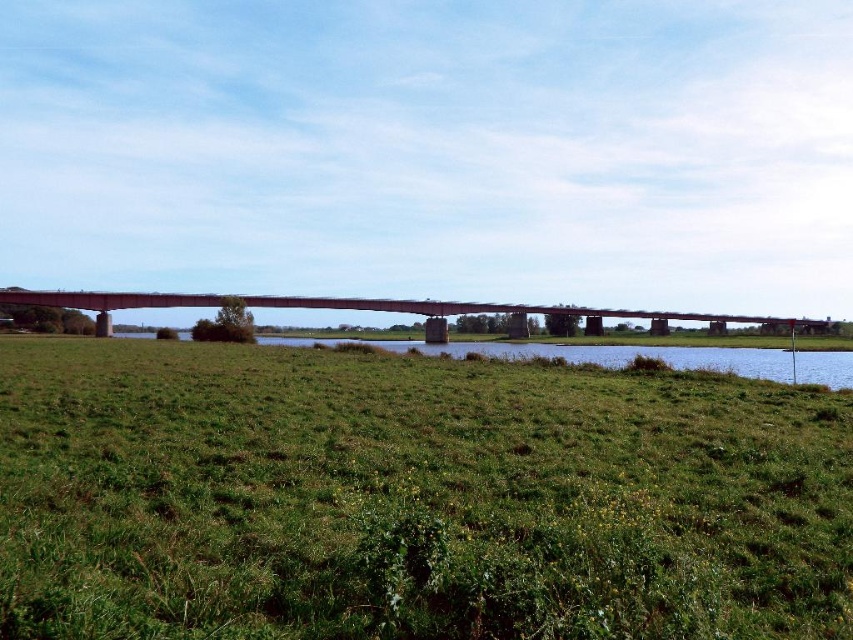
How much distance is there between green grassy field at center and concrete bridge at center?

The distance of green grassy field at center from concrete bridge at center is 95.30 meters.

Is green grassy field at center smaller than concrete bridge at center?

Yes.

Where is `green grassy field at center`? The image size is (853, 640). green grassy field at center is located at coordinates (412, 499).

Who is positioned more to the right, green grassy field at center or green grassy field at lower center?

green grassy field at center

Which of these two, green grassy field at center or green grassy field at lower center, stands taller?

green grassy field at lower center is taller.

Locate an element on the screen. The image size is (853, 640). green grassy field at center is located at coordinates (412, 499).

I want to click on green grassy field at center, so click(x=412, y=499).

Which is in front, point (544, 307) or point (737, 360)?

Positioned in front is point (737, 360).

Which is below, concrete bridge at center or green grassy field at lower center?

green grassy field at lower center is lower down.

Describe the element at coordinates (366, 307) in the screenshot. I see `concrete bridge at center` at that location.

What are the coordinates of `concrete bridge at center` in the screenshot? It's located at (366, 307).